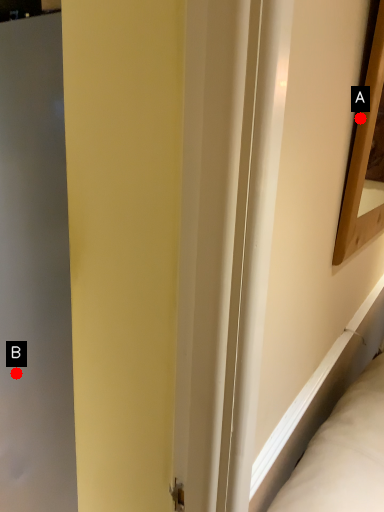
Question: Two points are circled on the image, labeled by A and B beside each circle. Which point appears closest to the camera in this image?

Choices:
 (A) A is closer
 (B) B is closer

Answer: (A)